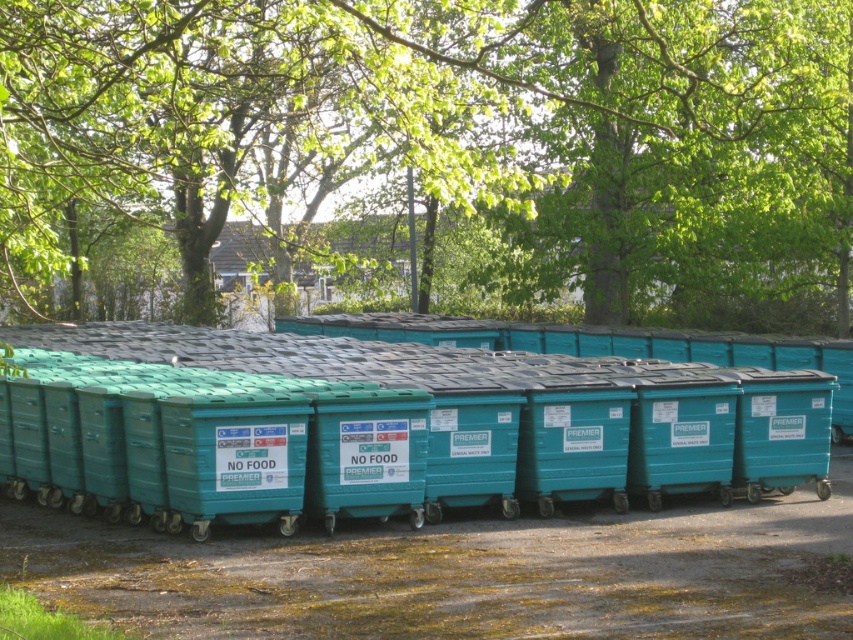
You are a gardener checking the spacing between the green leafy tree at upper center and the teal plastic bin at center. Which object is wider?

The green leafy tree at upper center is wider than the teal plastic bin at center according to the description.

You are standing at the point marked by the coordinates point (447, 147). Looking around, what do you see directly above you?

The point (447, 147) corresponds to the green leafy tree at upper center, so directly above you would be the branches and leaves of the green leafy tree at upper center.

You are standing 1.5 meters tall and looking at the green leafy tree at upper center. Can you see the top of the tree without moving your head?

The green leafy tree at upper center is 5.95 meters from camera. Since you are 1.5 meters tall, you can see the top of the tree without moving your head because the tree is taller than your eye level.